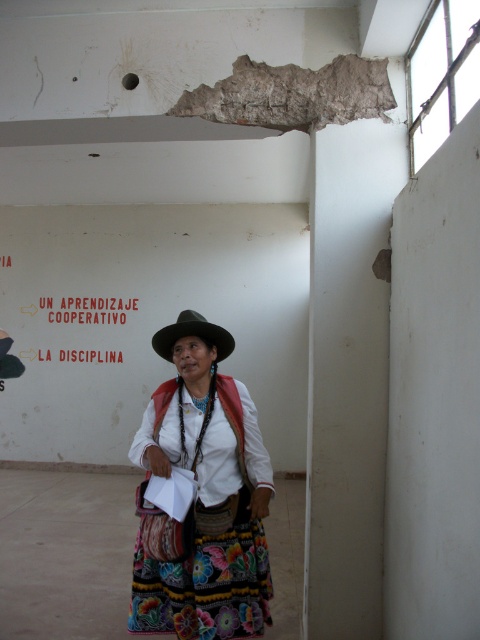
You are an interior designer visiting the construction site. You see the red paper sign at upper center and the green felt cowboy hat at center. Which object is positioned higher in the image?

The red paper sign at upper center is positioned higher than the green felt cowboy hat at center.